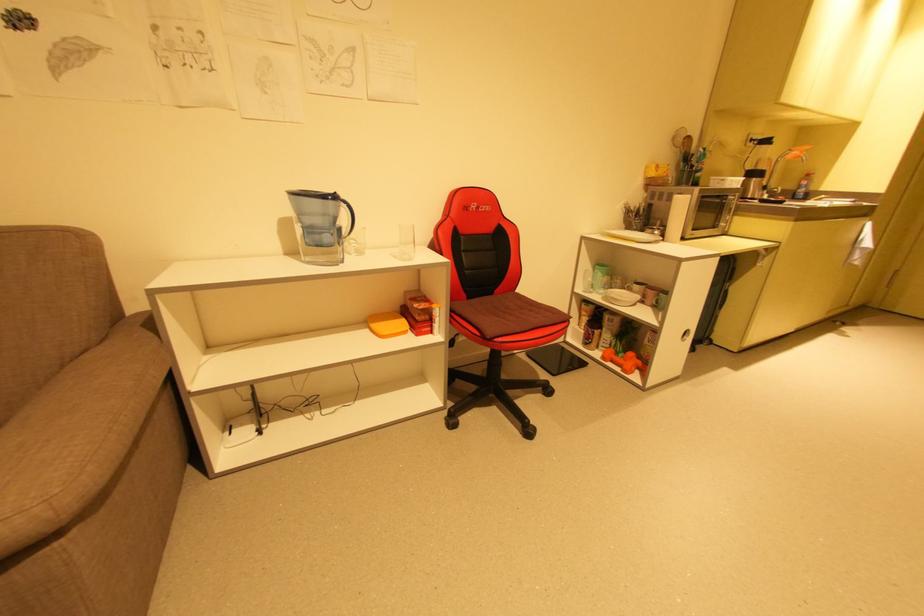
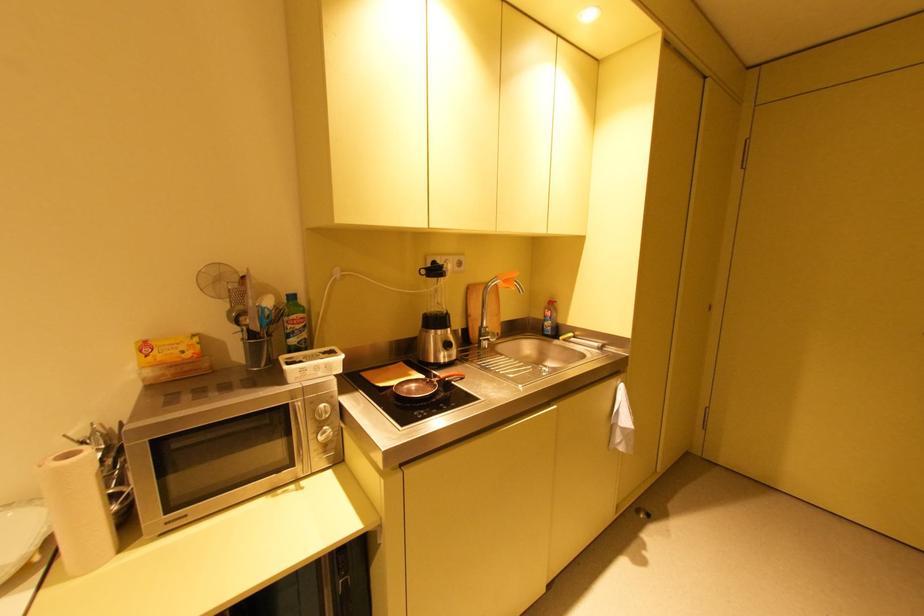
The point at (775, 139) is marked in the first image. Where is the corresponding point in the second image?

(444, 267)